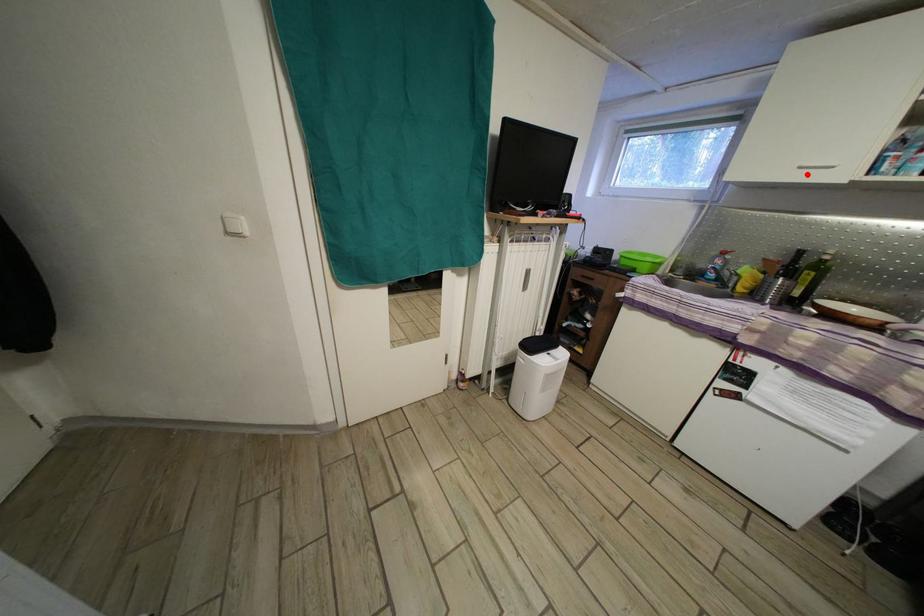
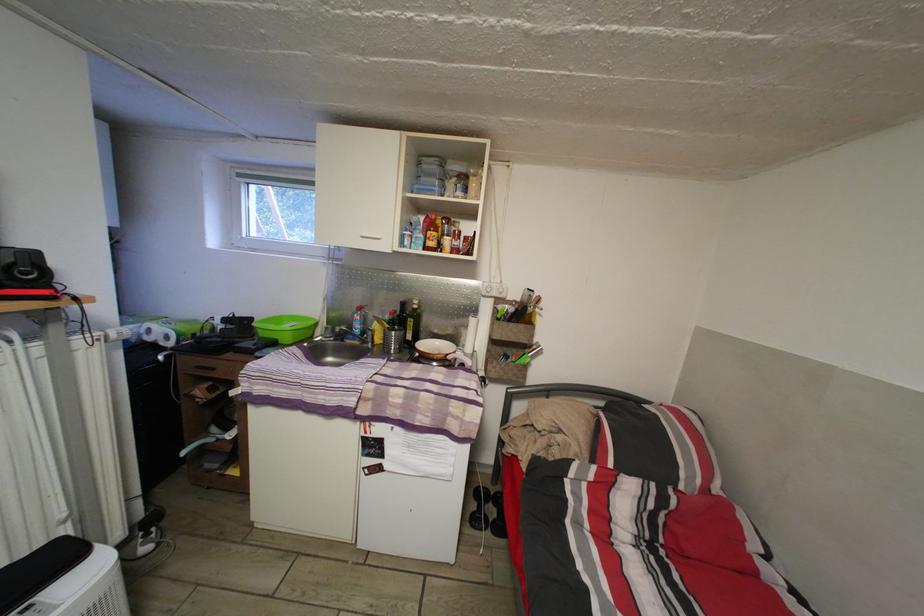
Question: I am providing you with two images of the same scene from different viewpoints. Given a red point in image1, look at the same physical point in image2. Is it:

Choices:
 (A) Closer to the viewpoint
 (B) Farther from the viewpoint

Answer: (A)